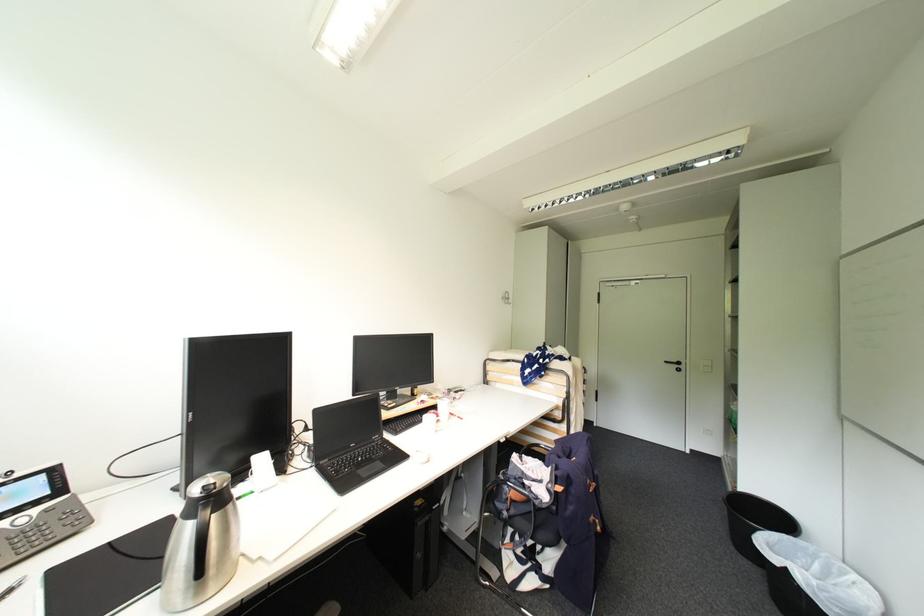
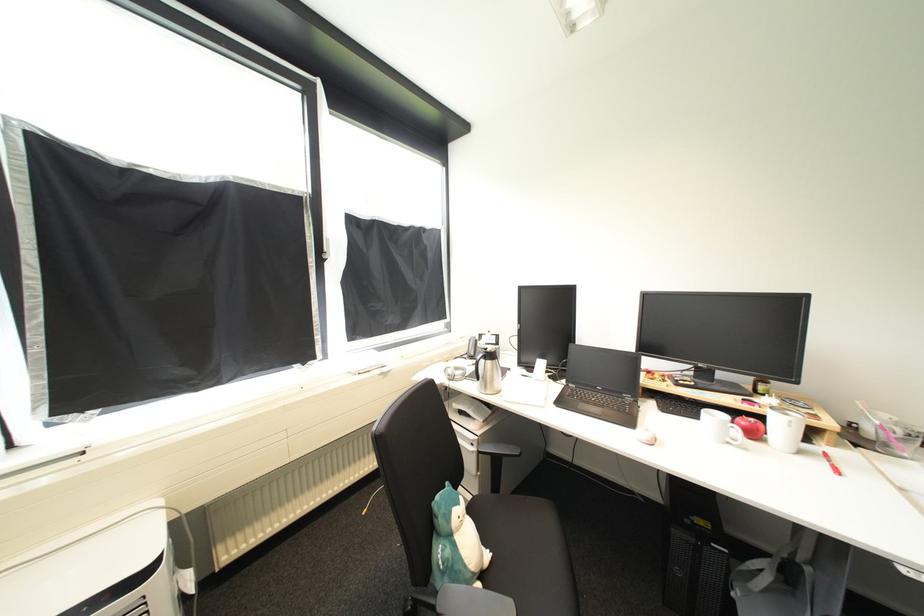
Question: How did the camera likely rotate?

Choices:
 (A) Left
 (B) Right
 (C) Up
 (D) Down

Answer: (A)